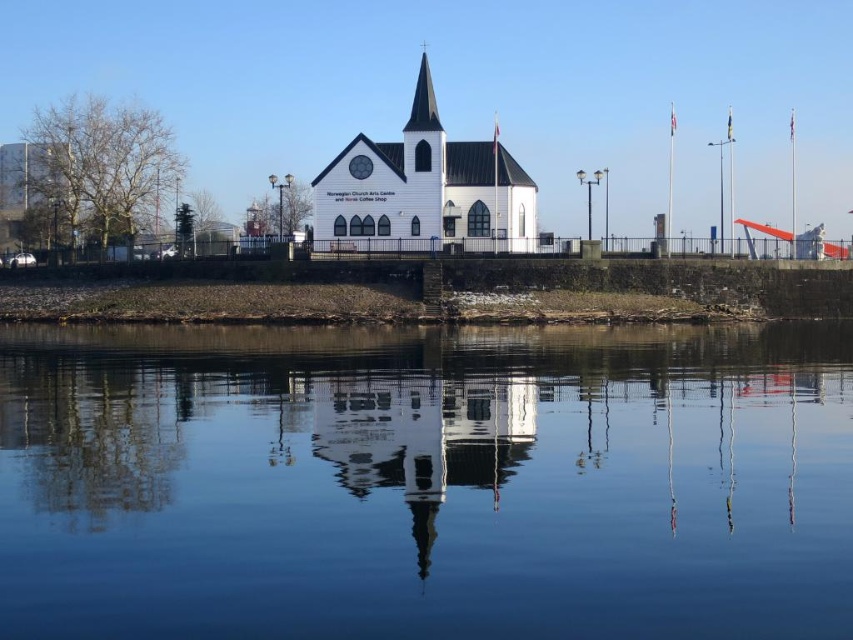
How much distance is there between transparent glass water at center and white wooden church at center?

transparent glass water at center is 30.54 meters away from white wooden church at center.

Find the location of a particular element. Image resolution: width=853 pixels, height=640 pixels. transparent glass water at center is located at coordinates (425, 481).

Where is `transparent glass water at center`? transparent glass water at center is located at coordinates (425, 481).

Is white wooden church at center positioned at the back of black glass spire at center?

That is False.

Measure the distance between point (x=491, y=189) and camera.

They are 459.93 feet apart.

Is point (457, 172) farther from camera compared to point (434, 122)?

Yes, point (457, 172) is behind point (434, 122).

Locate an element on the screen. white wooden church at center is located at coordinates (422, 189).

Based on the photo, who is taller, transparent glass water at center or black glass spire at center?

With more height is black glass spire at center.

This screenshot has height=640, width=853. In order to click on transparent glass water at center in this screenshot , I will do `click(425, 481)`.

This screenshot has height=640, width=853. In order to click on transparent glass water at center in this screenshot , I will do `click(425, 481)`.